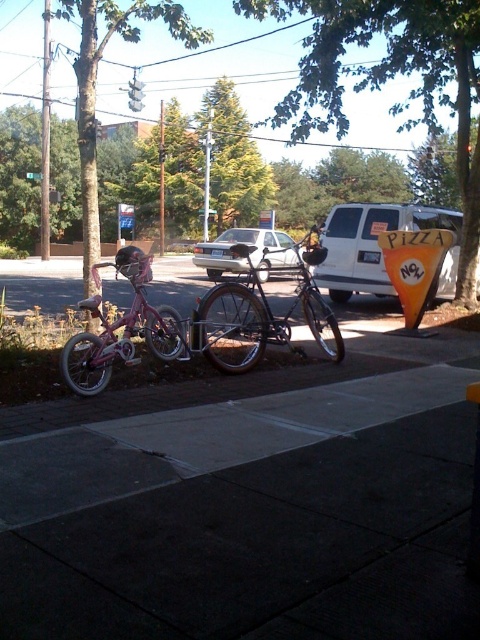
Between point (339, 246) and point (263, 240), which one is positioned in front?

Point (339, 246) is more forward.

At what (x,y) coordinates should I click in order to perform the action: click on white matte van at center. Please return your answer as a coordinate pair (x, y). The image size is (480, 640). Looking at the image, I should click on (377, 246).

Image resolution: width=480 pixels, height=640 pixels. I want to click on white matte van at center, so click(377, 246).

Is dark gray concrete sidewalk at lower center bigger than shiny silver bicycle at center?

Incorrect, dark gray concrete sidewalk at lower center is not larger than shiny silver bicycle at center.

Which is below, dark gray concrete sidewalk at lower center or shiny silver bicycle at center?

dark gray concrete sidewalk at lower center is below.

Is point (228, 452) in front of point (291, 244)?

Yes.

The height and width of the screenshot is (640, 480). I want to click on dark gray concrete sidewalk at lower center, so click(x=244, y=516).

Does white matte van at center have a lesser height compared to pink matte bicycle at left?

In fact, white matte van at center may be taller than pink matte bicycle at left.

Between white matte van at center and pink matte bicycle at left, which one is positioned higher?

white matte van at center

At what (x,y) coordinates should I click in order to perform the action: click on white matte van at center. Please return your answer as a coordinate pair (x, y). The image size is (480, 640). Looking at the image, I should click on (377, 246).

Locate an element on the screen. The height and width of the screenshot is (640, 480). white matte van at center is located at coordinates (377, 246).